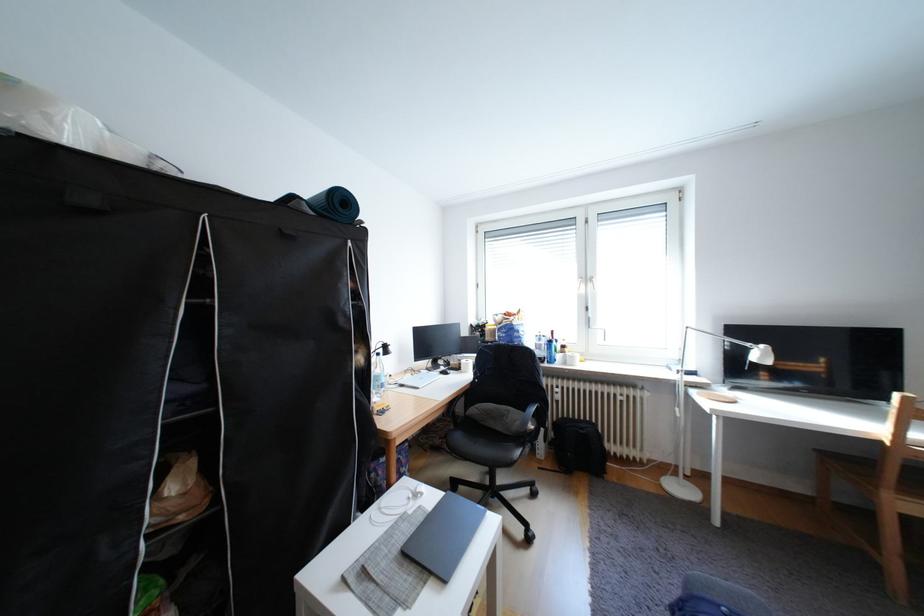
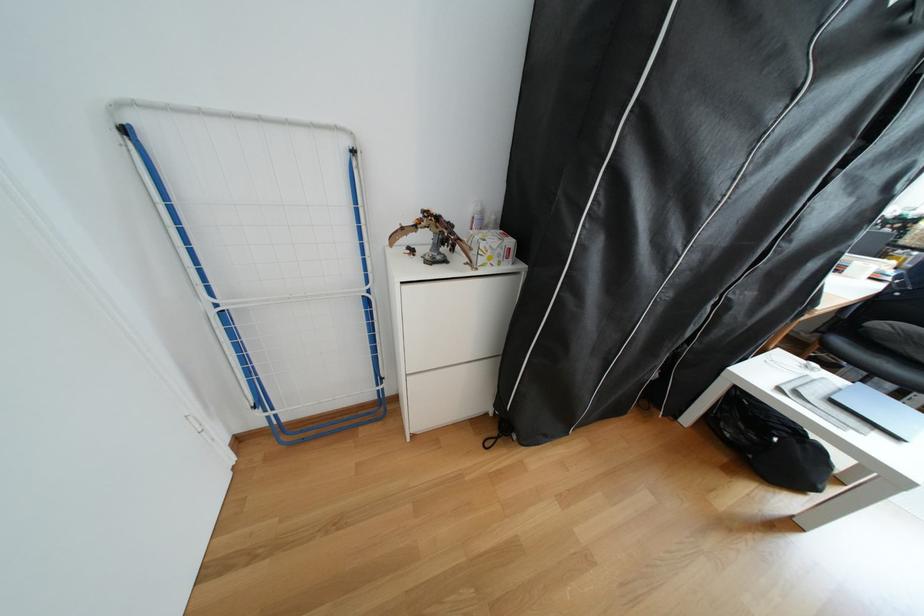
In the second image, find the point that corresponds to pixel 485 411 in the first image.

(894, 326)